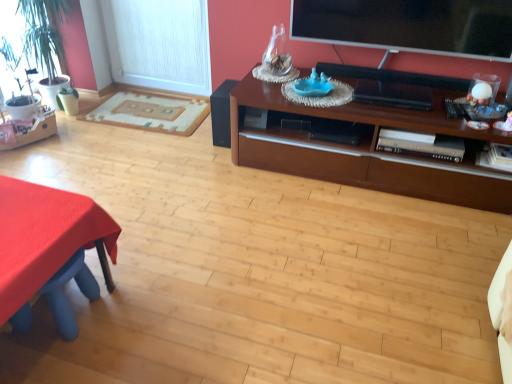
Identify the location of vacant area that lies between brown wood cabinet at upper right and red fabric table at lower left. (255, 242).